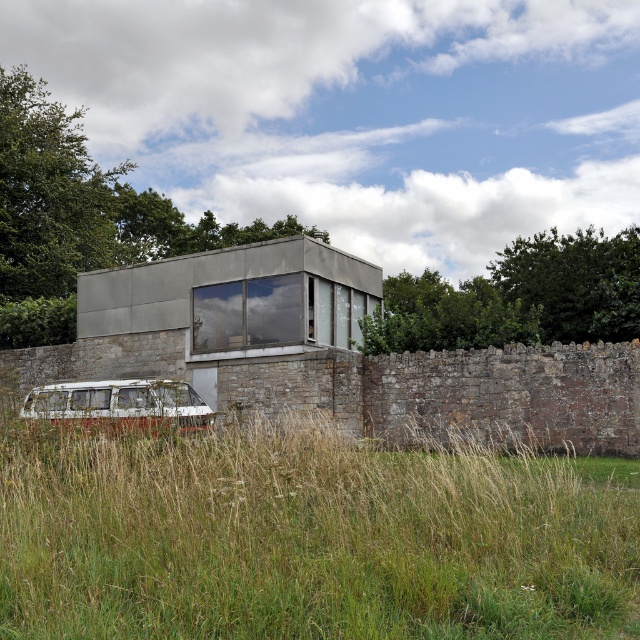
Is green grass at lower left bigger than white matte van at lower left?

Incorrect, green grass at lower left is not larger than white matte van at lower left.

Does point (584, 563) lie behind point (122, 381)?

No, (584, 563) is in front of (122, 381).

Where is `green grass at lower left`? green grass at lower left is located at coordinates (307, 538).